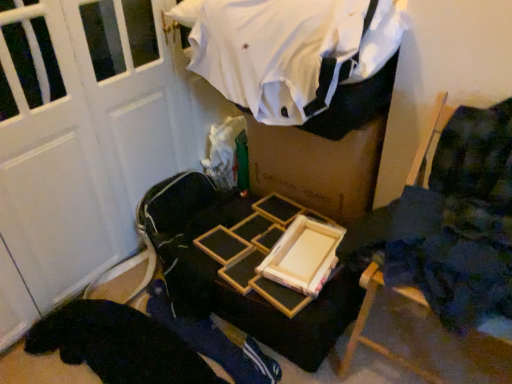
Question: Can you confirm if wooden frame at center is positioned to the left of blue fabric at center?

Choices:
 (A) no
 (B) yes

Answer: (A)

Question: From the image's perspective, is wooden frame at center on blue fabric at center?

Choices:
 (A) yes
 (B) no

Answer: (A)

Question: Is wooden frame at center behind blue fabric at center?

Choices:
 (A) yes
 (B) no

Answer: (A)

Question: Does wooden frame at center have a lesser width compared to blue fabric at center?

Choices:
 (A) no
 (B) yes

Answer: (B)

Question: Is blue fabric at center a part of wooden frame at center?

Choices:
 (A) no
 (B) yes

Answer: (A)

Question: From the image's perspective, is white cotton shirt at upper center above or below wooden frame at center?

Choices:
 (A) above
 (B) below

Answer: (A)

Question: Considering the positions of white cotton shirt at upper center and wooden frame at center in the image, is white cotton shirt at upper center bigger or smaller than wooden frame at center?

Choices:
 (A) big
 (B) small

Answer: (A)

Question: From a real-world perspective, is white cotton shirt at upper center positioned above or below wooden frame at center?

Choices:
 (A) below
 (B) above

Answer: (B)

Question: In the image, is white cotton shirt at upper center on the left side or the right side of wooden frame at center?

Choices:
 (A) left
 (B) right

Answer: (A)

Question: In terms of size, does wooden chair at right appear bigger or smaller than white cotton shirt at upper center?

Choices:
 (A) big
 (B) small

Answer: (A)

Question: From the image's perspective, is wooden chair at right located above or below white cotton shirt at upper center?

Choices:
 (A) above
 (B) below

Answer: (B)

Question: Would you say wooden chair at right is inside or outside white cotton shirt at upper center?

Choices:
 (A) inside
 (B) outside

Answer: (B)

Question: From a real-world perspective, is wooden chair at right above or below white cotton shirt at upper center?

Choices:
 (A) below
 (B) above

Answer: (A)

Question: From the image's perspective, relative to wooden frame at center, is blue fabric at center above or below?

Choices:
 (A) below
 (B) above

Answer: (A)

Question: Based on their positions, is blue fabric at center located to the left or right of wooden frame at center?

Choices:
 (A) right
 (B) left

Answer: (B)